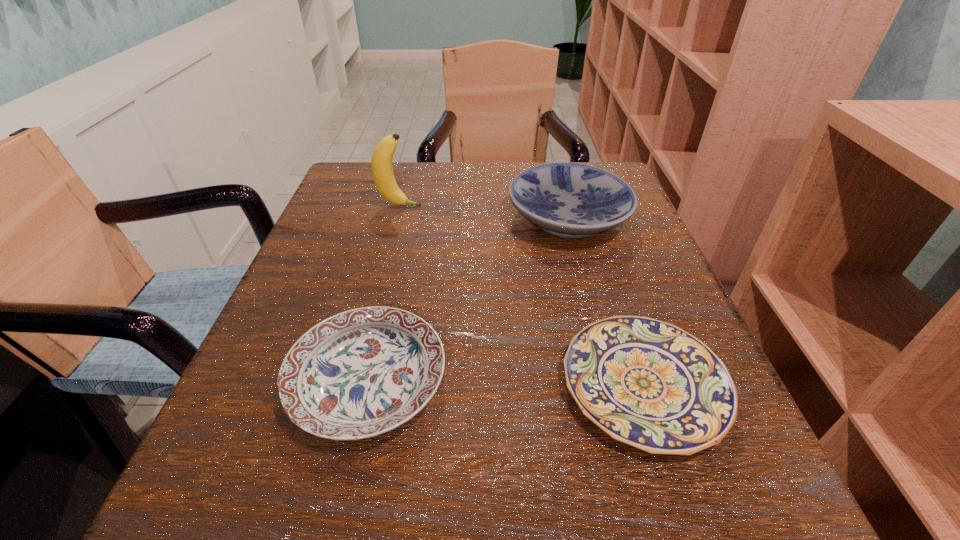
Locate an element on the screen. The width and height of the screenshot is (960, 540). banana is located at coordinates (382, 170).

Identify the location of the tallest plate. This screenshot has width=960, height=540. 570,200.

Find the location of a particular element. The image size is (960, 540). the second tallest object is located at coordinates (570, 200).

This screenshot has width=960, height=540. Identify the location of the second shortest object. (360, 373).

This screenshot has width=960, height=540. Find the location of `the second tallest plate`. the second tallest plate is located at coordinates (360, 373).

This screenshot has height=540, width=960. Find the location of `the shortest plate`. the shortest plate is located at coordinates (649, 384).

Locate an element on the screen. This screenshot has width=960, height=540. vacant space located 0.080m from the stem of the tallest object is located at coordinates (458, 206).

This screenshot has width=960, height=540. I want to click on vacant space located on the back of the farthest plate, so click(x=554, y=167).

Identify the location of vacant area situated 0.400m on the back of the leftmost plate. (411, 193).

The height and width of the screenshot is (540, 960). In order to click on vacant region located on the back of the shortest object in this screenshot , I will do `click(586, 211)`.